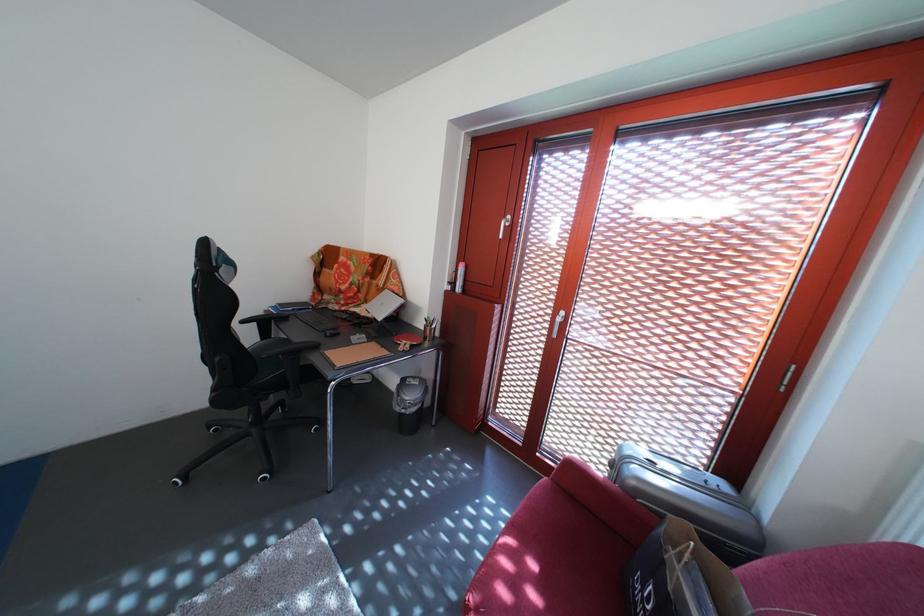
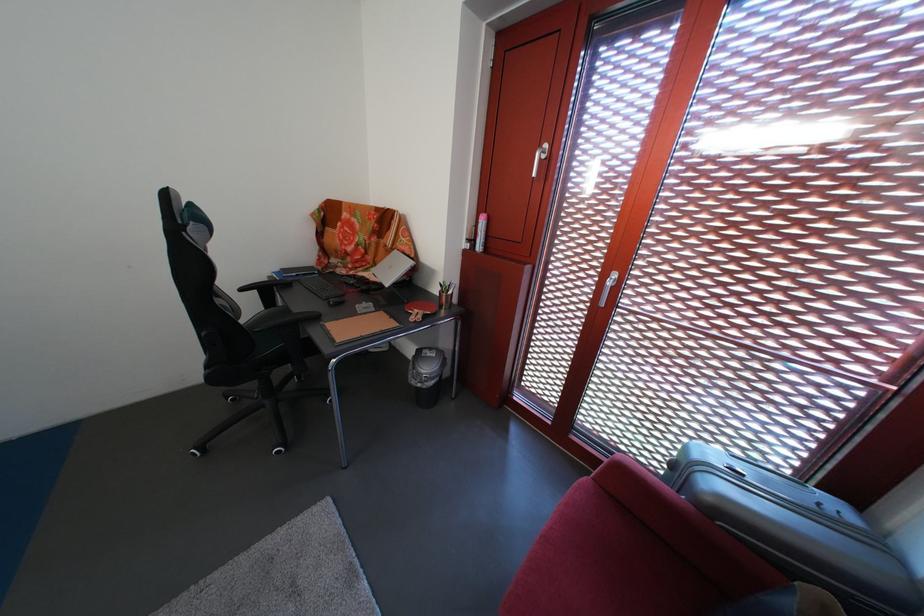
The point at (408, 416) is marked in the first image. Where is the corresponding point in the second image?

(424, 389)